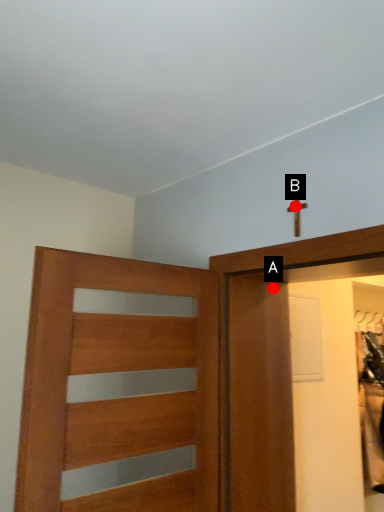
Question: Two points are circled on the image, labeled by A and B beside each circle. Which point appears closest to the camera in this image?

Choices:
 (A) A is closer
 (B) B is closer

Answer: (B)